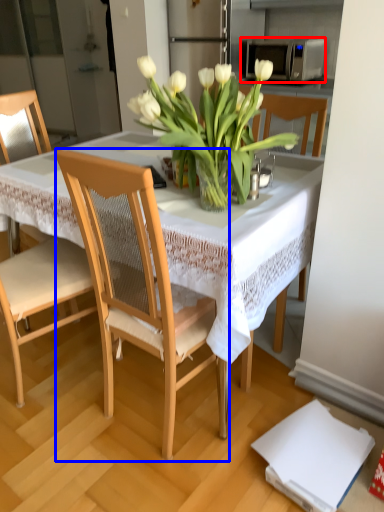
Question: Which point is further to the camera, microwave oven (highlighted by a red box) or chair (highlighted by a blue box)?

Choices:
 (A) microwave oven
 (B) chair

Answer: (A)